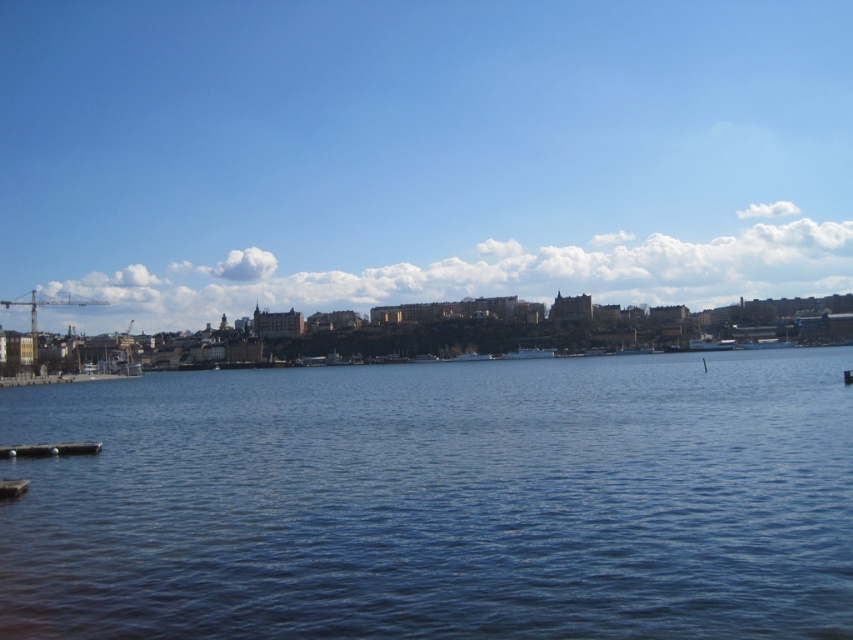
Is smooth wooden dock at lower left taller than brown wooden dock at lower left?

Indeed, smooth wooden dock at lower left has a greater height compared to brown wooden dock at lower left.

Who is more forward, (96, 445) or (16, 497)?

Positioned in front is point (16, 497).

Between point (3, 452) and point (16, 480), which one is positioned in front?

Point (16, 480) is more forward.

Where is `smooth wooden dock at lower left`? smooth wooden dock at lower left is located at coordinates (49, 449).

Is blue liquid water at center positioned before brown wooden dock at lower left?

Yes.

Who is shorter, blue liquid water at center or brown wooden dock at lower left?

brown wooden dock at lower left is shorter.

Is point (93, 625) in front of point (24, 480)?

Yes, point (93, 625) is in front of point (24, 480).

You are a GUI agent. You are given a task and a screenshot of the screen. Output one action in this format:
    pyautogui.click(x=<x>, y=<y>)
    Task: Click on the blue liquid water at center
    The height and width of the screenshot is (640, 853).
    Given the screenshot: What is the action you would take?
    pyautogui.click(x=439, y=500)

Is blue liquid water at center above smooth wooden dock at lower left?

Yes.

From the picture: Who is lower down, blue liquid water at center or smooth wooden dock at lower left?

smooth wooden dock at lower left is below.

Locate an element on the screen. The width and height of the screenshot is (853, 640). blue liquid water at center is located at coordinates (439, 500).

Locate an element on the screen. The width and height of the screenshot is (853, 640). blue liquid water at center is located at coordinates (439, 500).